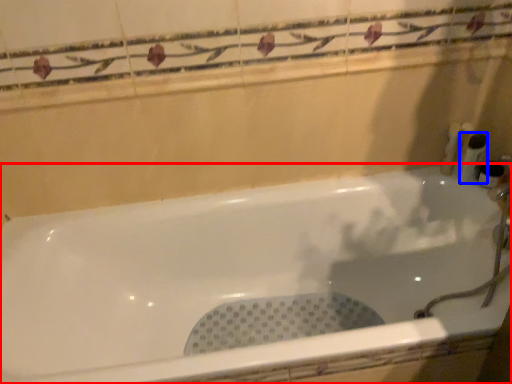
Question: Which object is closer to the camera taking this photo, bathtub (highlighted by a red box) or toiletry (highlighted by a blue box)?

Choices:
 (A) bathtub
 (B) toiletry

Answer: (A)